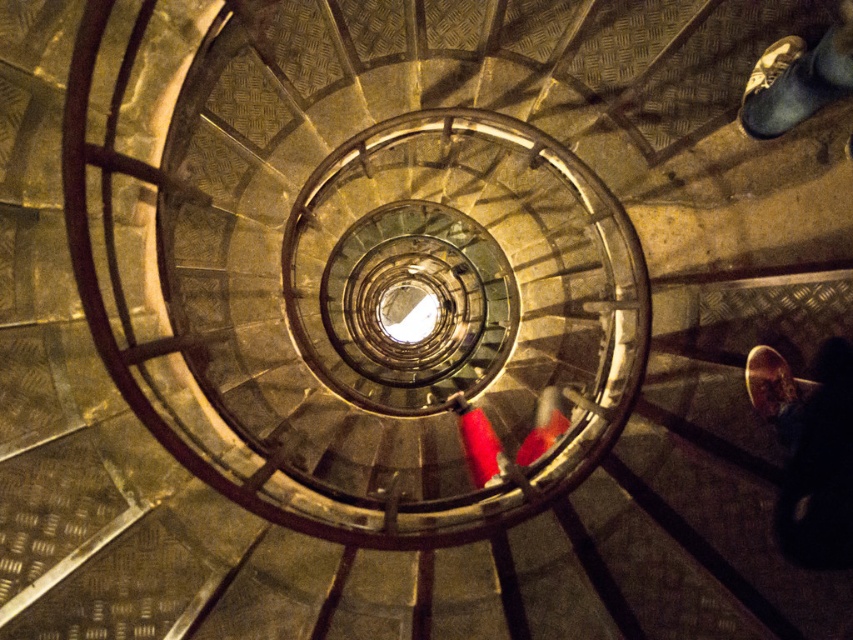
Question: Which point is farther from the camera taking this photo?

Choices:
 (A) (805, 422)
 (B) (822, 54)

Answer: (A)

Question: Which point appears closest to the camera in this image?

Choices:
 (A) (827, 438)
 (B) (560, 416)
 (C) (811, 74)

Answer: (C)

Question: Considering the relative positions of leather shoe at lower right and leather shoe at upper right in the image provided, where is leather shoe at lower right located with respect to leather shoe at upper right?

Choices:
 (A) below
 (B) above

Answer: (A)

Question: Is leather shoe at lower right positioned at the back of rubberized red shoes at center?

Choices:
 (A) yes
 (B) no

Answer: (B)

Question: Which is nearer to the leather shoe at lower right?

Choices:
 (A) leather shoe at upper right
 (B) rubberized red shoes at center

Answer: (A)

Question: Can you confirm if leather shoe at lower right is wider than rubberized red shoes at center?

Choices:
 (A) yes
 (B) no

Answer: (B)